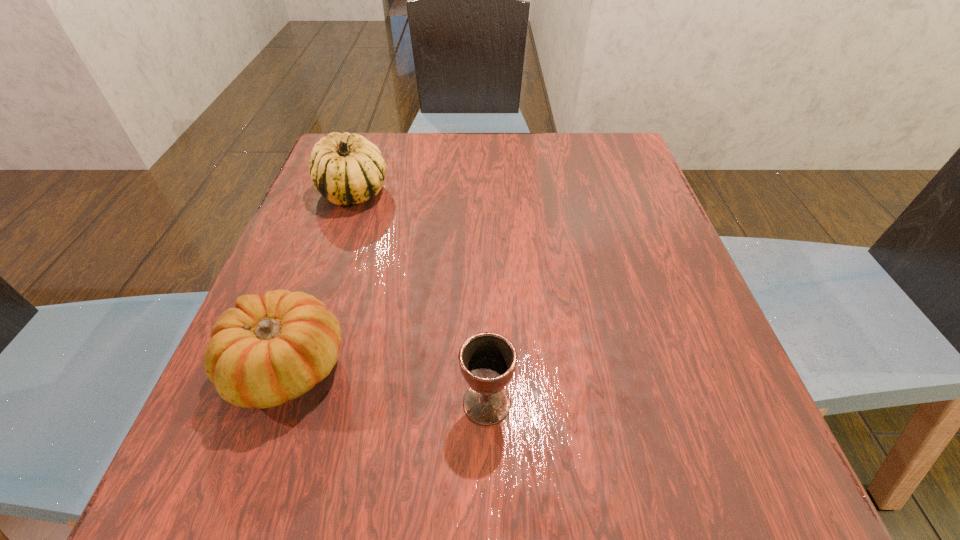
The width and height of the screenshot is (960, 540). I want to click on vacant space that is in between the farther gourd and the nearer gourd, so [320, 279].

Where is `empty location between the rightmost object and the farthest object`? The height and width of the screenshot is (540, 960). empty location between the rightmost object and the farthest object is located at coordinates (420, 298).

Where is `vacant space in between the farther gourd and the shorter gourd`? Image resolution: width=960 pixels, height=540 pixels. vacant space in between the farther gourd and the shorter gourd is located at coordinates (320, 279).

The image size is (960, 540). Find the location of `blank region between the chalice and the farther gourd`. blank region between the chalice and the farther gourd is located at coordinates (420, 298).

Identify which object is located as the nearest to the nearer gourd. Please provide its 2D coordinates. Your answer should be formatted as a tuple, i.e. [(x, y)], where the tuple contains the x and y coordinates of a point satisfying the conditions above.

[(487, 360)]

Find the location of a particular element. Image resolution: width=960 pixels, height=540 pixels. object that is the closest one to the farthest object is located at coordinates (269, 349).

Where is `vacant space that satisfies the following two spatial constraints: 1. on the back side of the nearer gourd; 2. on the left side of the farther gourd`? This screenshot has height=540, width=960. vacant space that satisfies the following two spatial constraints: 1. on the back side of the nearer gourd; 2. on the left side of the farther gourd is located at coordinates (348, 192).

The image size is (960, 540). In order to click on free location that satisfies the following two spatial constraints: 1. on the front side of the chalice; 2. on the left side of the nearer gourd in this screenshot , I will do `click(274, 403)`.